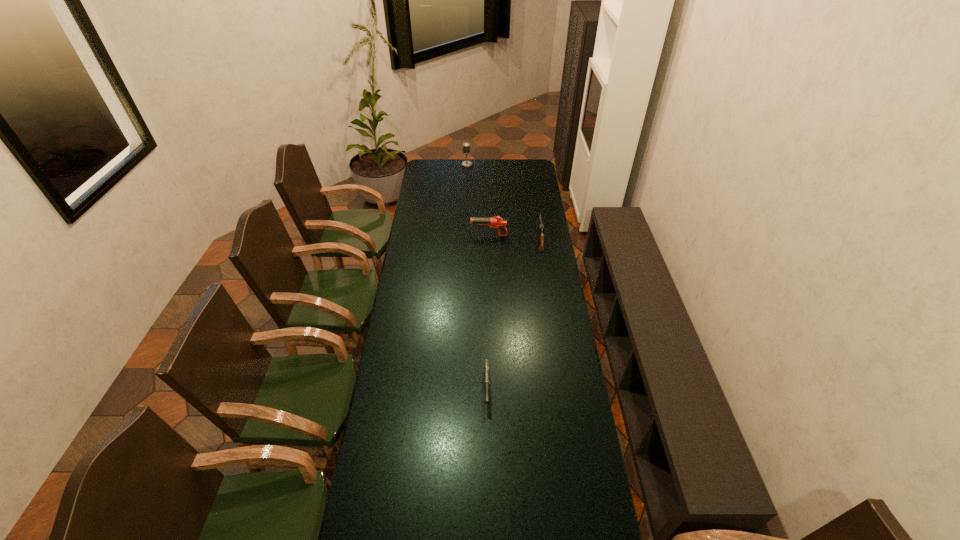
Locate which object is the third closest to the rightmost gun. Please provide its 2D coordinates. Your answer should be formatted as a tuple, i.e. [(x, y)], where the tuple contains the x and y coordinates of a point satisfying the conditions above.

[(486, 364)]

Find the location of a particular element. Image resolution: width=960 pixels, height=540 pixels. object that stands as the third closest to the nearest gun is located at coordinates (466, 146).

Find the location of a particular element. The height and width of the screenshot is (540, 960). the second closest gun to the nearest object is located at coordinates (499, 223).

Select which gun is the closest to the shortest gun. Please provide its 2D coordinates. Your answer should be formatted as a tuple, i.e. [(x, y)], where the tuple contains the x and y coordinates of a point satisfying the conditions above.

[(541, 227)]